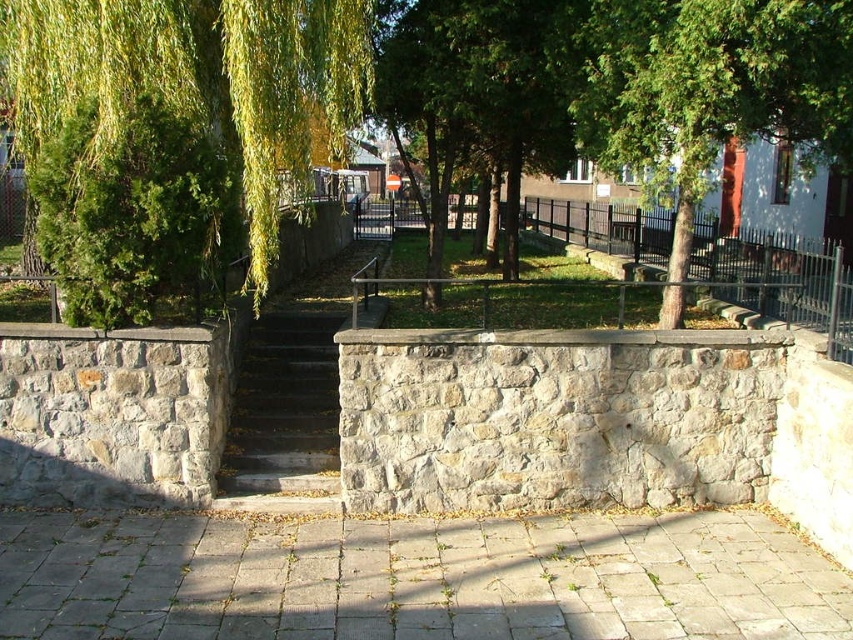
Between green leafy willow at left and dark gray stone stairs at center, which one has more height?

Standing taller between the two is green leafy willow at left.

In the scene shown: Does green leafy willow at left have a larger size compared to dark gray stone stairs at center?

Yes.

At what (x,y) coordinates should I click in order to perform the action: click on green leafy willow at left. Please return your answer as a coordinate pair (x, y). Image resolution: width=853 pixels, height=640 pixels. Looking at the image, I should click on (198, 77).